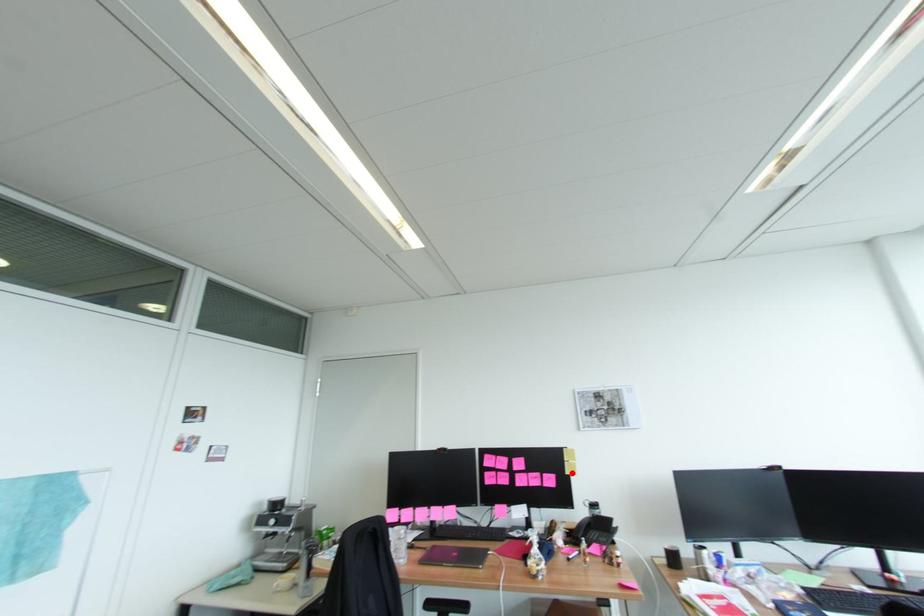
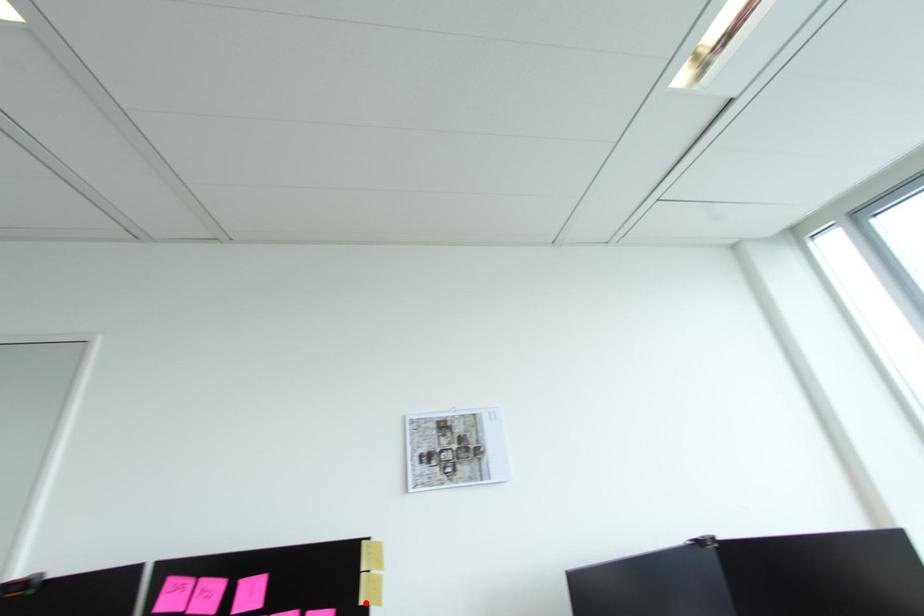
I am providing you with two images of the same scene from different viewpoints. A red point is marked on the first image and another point is marked on the second image. Is the red point in image1 aligned with the point shown in image2?

Yes